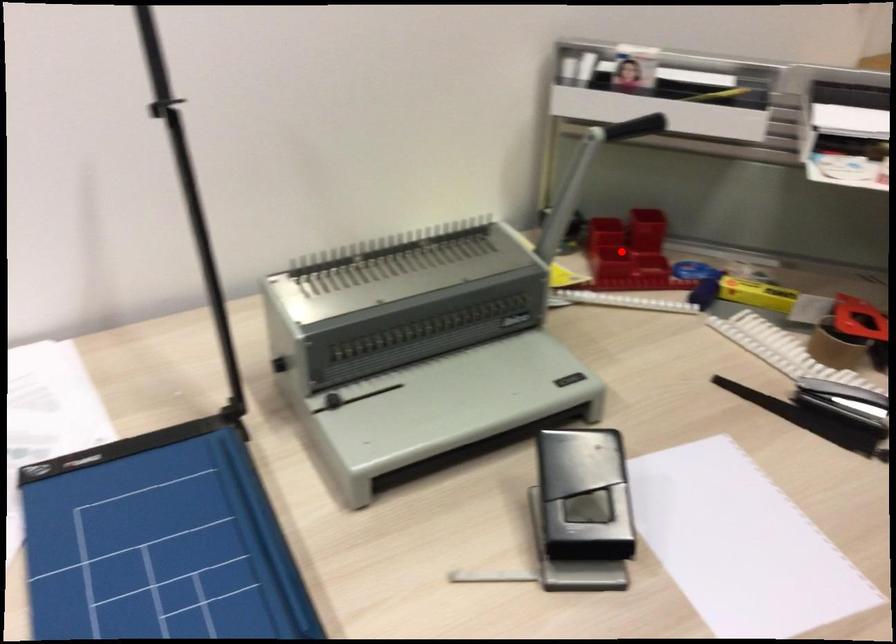
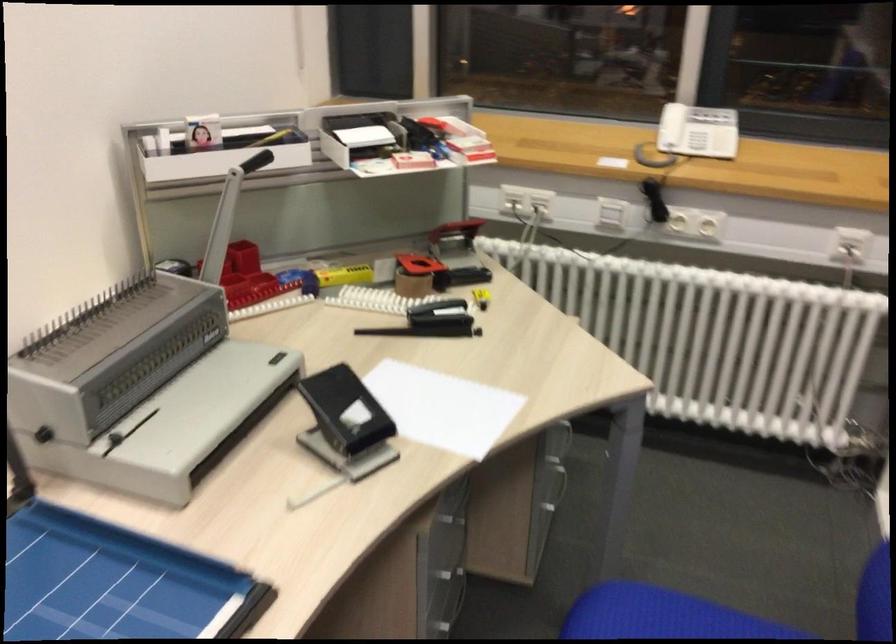
Question: I am providing you with two images of the same scene from different viewpoints. Image1 has a red point marked. In image2, the corresponding 3D location appears at what relative position? Reply with the corresponding letter.

Choices:
 (A) Closer
 (B) Farther

Answer: (B)